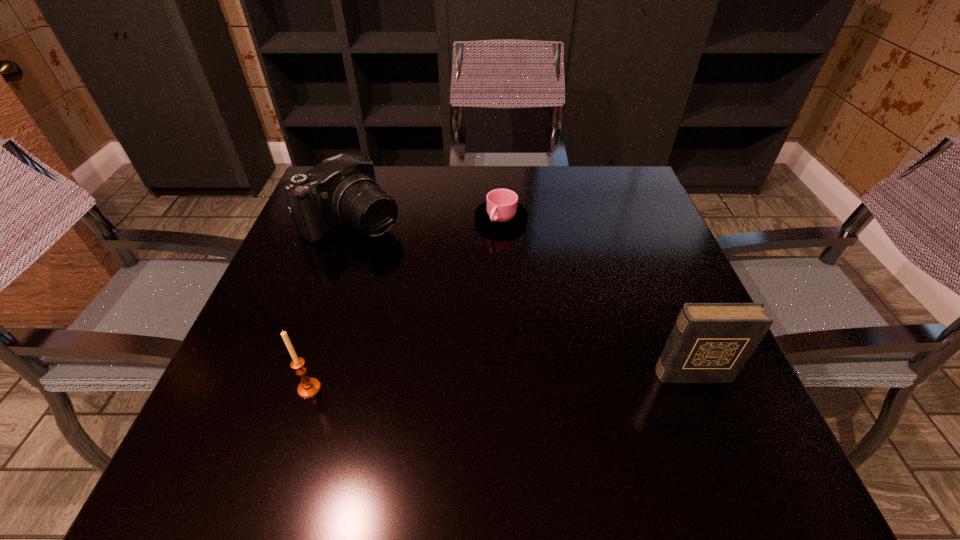
Locate an element on the screen. vacant space on the desktop that is between the candle_holder and the rightmost object and is positioned on the lens of the camera is located at coordinates (548, 380).

At what (x,y) coordinates should I click in order to perform the action: click on free space on the desktop that is between the candle_holder and the diary and is positioned on the side with the handle of the shortest object. Please return your answer as a coordinate pair (x, y). Looking at the image, I should click on (471, 383).